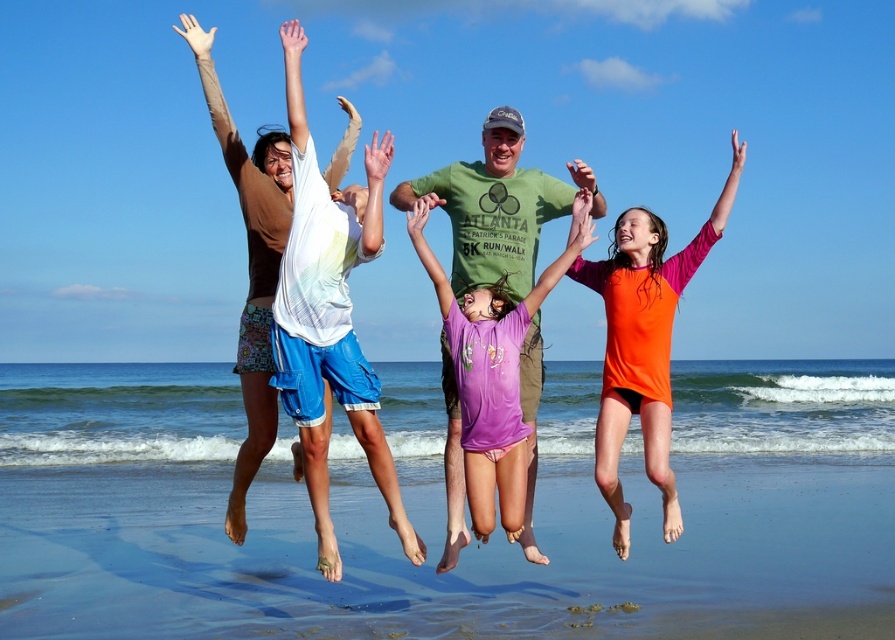
Is matte white shirt at center smaller than purple cotton shirt at center?

Incorrect, matte white shirt at center is not smaller in size than purple cotton shirt at center.

Which of these two, matte white shirt at center or purple cotton shirt at center, stands taller?

Result: With more height is matte white shirt at center.

Locate an element on the screen. matte white shirt at center is located at coordinates (646, 348).

Is smooth sand at lower center positioned in front of purple cotton shirt at center?

No.

Who is positioned more to the right, smooth sand at lower center or purple cotton shirt at center?

From the viewer's perspective, smooth sand at lower center appears more on the right side.

Measure the distance between point (759, 595) and camera.

Point (759, 595) is 28.29 feet away from camera.

Find the location of a particular element. This screenshot has width=895, height=640. smooth sand at lower center is located at coordinates click(x=437, y=554).

Who is positioned more to the right, matte white shirt at center or orange rash guard at center?

From the viewer's perspective, matte white shirt at center appears more on the right side.

Looking at this image, who is more distant from viewer, (x=648, y=474) or (x=646, y=237)?

Positioned behind is point (x=648, y=474).

Identify the location of matte white shirt at center. (646, 348).